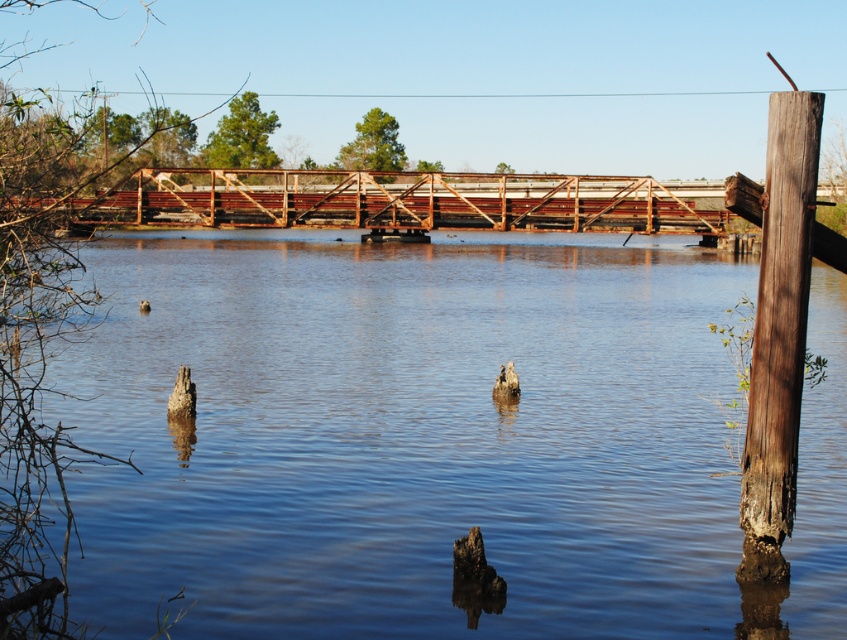
Who is higher up, blue water at center or brown fuzzy duck at center?

blue water at center

Between blue water at center and brown fuzzy duck at center, which one is positioned lower?

brown fuzzy duck at center

Where is `blue water at center`? The image size is (847, 640). blue water at center is located at coordinates (405, 435).